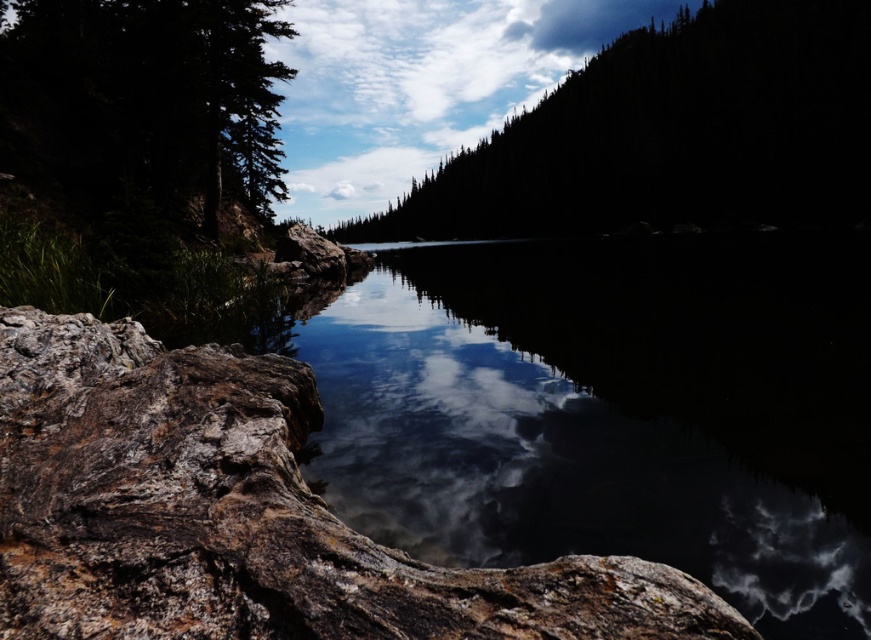
You are standing at the edge of the water in the serene landscape scene. You notice two points marked in the image. Which point, point [639,554] or point [157,77], is closer to you?

Point [639,554] is closer to the viewer than point [157,77].

You are an artist trying to paint the scene. You have a limited amount of green paint. The transparent glass water at center and the green matte tree at upper left are both in your view. Which object requires less green paint to cover its visible area?

The transparent glass water at center requires less green paint because it has a smaller size compared to the green matte tree at upper left.